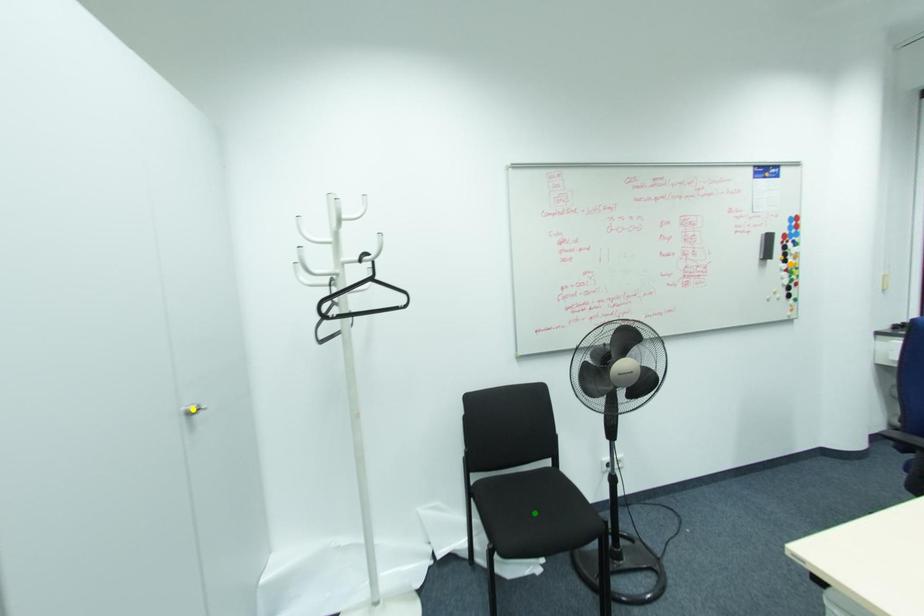
Order these from nearest to farthest:
1. green point
2. orange point
3. yellow point

1. orange point
2. green point
3. yellow point